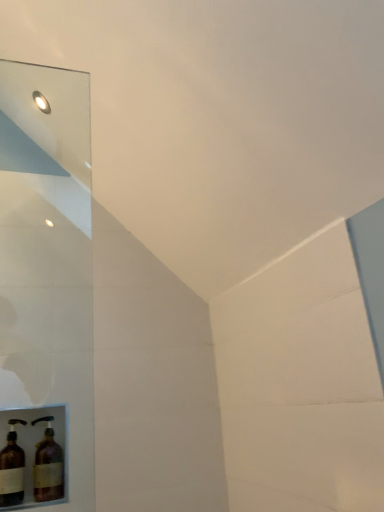
What is the approximate height of brown glass bottle at lower left, arranged as the 2th bottle when viewed from the right?

brown glass bottle at lower left, arranged as the 2th bottle when viewed from the right, is 11.13 inches in height.

Identify the location of brown glass bottle at lower left, marked as the 1th bottle in a left-to-right arrangement. (12, 468).

What do you see at coordinates (12, 468) in the screenshot? The width and height of the screenshot is (384, 512). I see `brown glass bottle at lower left, arranged as the 2th bottle when viewed from the right` at bounding box center [12, 468].

The width and height of the screenshot is (384, 512). Describe the element at coordinates (48, 465) in the screenshot. I see `brown glass bottle at lower left, which ranks as the 1th bottle in right-to-left order` at that location.

How much space does brown glass bottle at lower left, which ranks as the 1th bottle in right-to-left order, occupy horizontally?

4.53 inches.

Find the location of a particular element. brown glass bottle at lower left, which appears as the 2th bottle when viewed from the left is located at coordinates (48, 465).

At what (x,y) coordinates should I click in order to perform the action: click on brown glass bottle at lower left, marked as the 1th bottle in a left-to-right arrangement. Please return your answer as a coordinate pair (x, y). Looking at the image, I should click on (12, 468).

Based on the photo, can you confirm if brown glass bottle at lower left, arranged as the 2th bottle when viewed from the right, is positioned to the right of brown glass bottle at lower left, which appears as the 2th bottle when viewed from the left?

In fact, brown glass bottle at lower left, arranged as the 2th bottle when viewed from the right, is to the left of brown glass bottle at lower left, which appears as the 2th bottle when viewed from the left.

Is brown glass bottle at lower left, arranged as the 2th bottle when viewed from the right, further to camera compared to brown glass bottle at lower left, which ranks as the 1th bottle in right-to-left order?

No, brown glass bottle at lower left, arranged as the 2th bottle when viewed from the right, is closer to the viewer.

Is point (5, 447) more distant than point (36, 490)?

Yes, point (5, 447) is farther from viewer.

Consider the image. From the image's perspective, which object appears higher, brown glass bottle at lower left, marked as the 1th bottle in a left-to-right arrangement, or brown glass bottle at lower left, which appears as the 2th bottle when viewed from the left?

brown glass bottle at lower left, marked as the 1th bottle in a left-to-right arrangement, is shown above in the image.

Based on the photo, from a real-world perspective, is brown glass bottle at lower left, marked as the 1th bottle in a left-to-right arrangement, on top of brown glass bottle at lower left, which ranks as the 1th bottle in right-to-left order?

Actually, brown glass bottle at lower left, marked as the 1th bottle in a left-to-right arrangement, is physically below brown glass bottle at lower left, which ranks as the 1th bottle in right-to-left order, in the real world.

Considering the relative sizes of brown glass bottle at lower left, marked as the 1th bottle in a left-to-right arrangement, and brown glass bottle at lower left, which ranks as the 1th bottle in right-to-left order, in the image provided, is brown glass bottle at lower left, marked as the 1th bottle in a left-to-right arrangement, wider than brown glass bottle at lower left, which ranks as the 1th bottle in right-to-left order,?

Incorrect, the width of brown glass bottle at lower left, marked as the 1th bottle in a left-to-right arrangement, does not surpass that of brown glass bottle at lower left, which ranks as the 1th bottle in right-to-left order.

Looking at this image, does brown glass bottle at lower left, arranged as the 2th bottle when viewed from the right, have a greater height compared to brown glass bottle at lower left, which ranks as the 1th bottle in right-to-left order?

Correct, brown glass bottle at lower left, arranged as the 2th bottle when viewed from the right, is much taller as brown glass bottle at lower left, which ranks as the 1th bottle in right-to-left order.

Is brown glass bottle at lower left, arranged as the 2th bottle when viewed from the right, bigger than brown glass bottle at lower left, which ranks as the 1th bottle in right-to-left order?

No, brown glass bottle at lower left, arranged as the 2th bottle when viewed from the right, is not bigger than brown glass bottle at lower left, which ranks as the 1th bottle in right-to-left order.

Choose the correct answer: Is brown glass bottle at lower left, arranged as the 2th bottle when viewed from the right, inside brown glass bottle at lower left, which appears as the 2th bottle when viewed from the left, or outside it?

brown glass bottle at lower left, arranged as the 2th bottle when viewed from the right, is outside brown glass bottle at lower left, which appears as the 2th bottle when viewed from the left.

Looking at this image, are brown glass bottle at lower left, arranged as the 2th bottle when viewed from the right, and brown glass bottle at lower left, which ranks as the 1th bottle in right-to-left order, located far from each other?

No, brown glass bottle at lower left, arranged as the 2th bottle when viewed from the right, is not far from brown glass bottle at lower left, which ranks as the 1th bottle in right-to-left order.

Is brown glass bottle at lower left, marked as the 1th bottle in a left-to-right arrangement, positioned with its back to brown glass bottle at lower left, which ranks as the 1th bottle in right-to-left order?

brown glass bottle at lower left, marked as the 1th bottle in a left-to-right arrangement, is not turned away from brown glass bottle at lower left, which ranks as the 1th bottle in right-to-left order.

At what (x,y) coordinates should I click in order to perform the action: click on bottle located underneath the brown glass bottle at lower left, which ranks as the 1th bottle in right-to-left order (from a real-world perspective). Please return your answer as a coordinate pair (x, y). This screenshot has width=384, height=512. Looking at the image, I should click on (12, 468).

Based on their positions, is brown glass bottle at lower left, which ranks as the 1th bottle in right-to-left order, located to the left or right of brown glass bottle at lower left, marked as the 1th bottle in a left-to-right arrangement?

Based on their positions, brown glass bottle at lower left, which ranks as the 1th bottle in right-to-left order, is located to the right of brown glass bottle at lower left, marked as the 1th bottle in a left-to-right arrangement.

Considering their positions, is brown glass bottle at lower left, which appears as the 2th bottle when viewed from the left, located in front of or behind brown glass bottle at lower left, marked as the 1th bottle in a left-to-right arrangement?

brown glass bottle at lower left, which appears as the 2th bottle when viewed from the left, is behind brown glass bottle at lower left, marked as the 1th bottle in a left-to-right arrangement.

Does point (41, 472) come in front of point (14, 453)?

Yes, it is.

From the image's perspective, is brown glass bottle at lower left, which ranks as the 1th bottle in right-to-left order, below brown glass bottle at lower left, arranged as the 2th bottle when viewed from the right?

Indeed, from the image's perspective, brown glass bottle at lower left, which ranks as the 1th bottle in right-to-left order, is shown beneath brown glass bottle at lower left, arranged as the 2th bottle when viewed from the right.

From a real-world perspective, is brown glass bottle at lower left, which appears as the 2th bottle when viewed from the left, on brown glass bottle at lower left, marked as the 1th bottle in a left-to-right arrangement?

Yes, from a real-world perspective, brown glass bottle at lower left, which appears as the 2th bottle when viewed from the left, is over brown glass bottle at lower left, marked as the 1th bottle in a left-to-right arrangement

Considering the sizes of objects brown glass bottle at lower left, which appears as the 2th bottle when viewed from the left, and brown glass bottle at lower left, marked as the 1th bottle in a left-to-right arrangement, in the image provided, who is wider, brown glass bottle at lower left, which appears as the 2th bottle when viewed from the left, or brown glass bottle at lower left, marked as the 1th bottle in a left-to-right arrangement,?

brown glass bottle at lower left, which appears as the 2th bottle when viewed from the left, is wider.

From their relative heights in the image, would you say brown glass bottle at lower left, which appears as the 2th bottle when viewed from the left, is taller or shorter than brown glass bottle at lower left, arranged as the 2th bottle when viewed from the right?

Clearly, brown glass bottle at lower left, which appears as the 2th bottle when viewed from the left, is shorter compared to brown glass bottle at lower left, arranged as the 2th bottle when viewed from the right.

Is brown glass bottle at lower left, which ranks as the 1th bottle in right-to-left order, bigger than brown glass bottle at lower left, marked as the 1th bottle in a left-to-right arrangement?

Indeed, brown glass bottle at lower left, which ranks as the 1th bottle in right-to-left order, has a larger size compared to brown glass bottle at lower left, marked as the 1th bottle in a left-to-right arrangement.

Is brown glass bottle at lower left, which appears as the 2th bottle when viewed from the left, not inside brown glass bottle at lower left, arranged as the 2th bottle when viewed from the right?

Yes, brown glass bottle at lower left, which appears as the 2th bottle when viewed from the left, is located beyond the bounds of brown glass bottle at lower left, arranged as the 2th bottle when viewed from the right.

Are brown glass bottle at lower left, which appears as the 2th bottle when viewed from the left, and brown glass bottle at lower left, marked as the 1th bottle in a left-to-right arrangement, beside each other?

Yes, brown glass bottle at lower left, which appears as the 2th bottle when viewed from the left, is touching brown glass bottle at lower left, marked as the 1th bottle in a left-to-right arrangement.

Is brown glass bottle at lower left, which ranks as the 1th bottle in right-to-left order, turned away from brown glass bottle at lower left, marked as the 1th bottle in a left-to-right arrangement?

No, brown glass bottle at lower left, which ranks as the 1th bottle in right-to-left order, is not facing away from brown glass bottle at lower left, marked as the 1th bottle in a left-to-right arrangement.

Locate an element on the screen. bottle on the right of the brown glass bottle at lower left, arranged as the 2th bottle when viewed from the right is located at coordinates (48, 465).

Where is `bottle that appears behind the brown glass bottle at lower left, marked as the 1th bottle in a left-to-right arrangement`? bottle that appears behind the brown glass bottle at lower left, marked as the 1th bottle in a left-to-right arrangement is located at coordinates (48, 465).

Locate an element on the screen. bottle on the left side of brown glass bottle at lower left, which appears as the 2th bottle when viewed from the left is located at coordinates (12, 468).